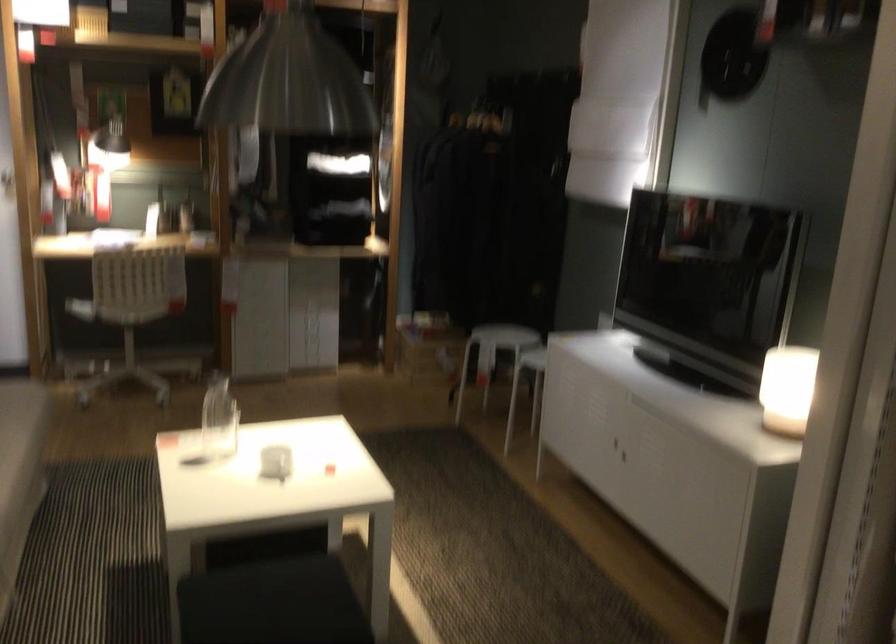
You are a GUI agent. You are given a task and a screenshot of the screen. Output one action in this format:
    pyautogui.click(x=<x>, y=<y>)
    Task: Click on the chair sitting surface
    The height and width of the screenshot is (644, 896).
    Given the screenshot: What is the action you would take?
    pyautogui.click(x=80, y=308)